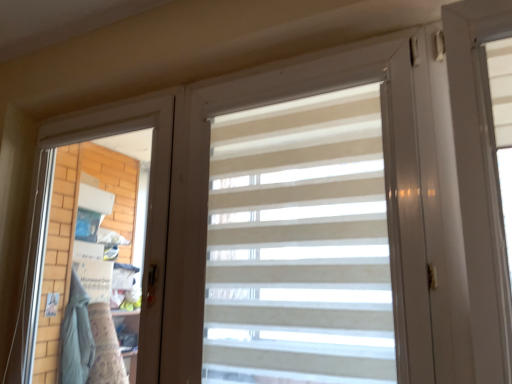
Question: Should I look upward or downward to see beige striped curtain at center?

Choices:
 (A) up
 (B) down

Answer: (B)

Question: Is beige striped curtain at center looking in the opposite direction of white matte screen door at left?

Choices:
 (A) no
 (B) yes

Answer: (A)

Question: Can you see beige striped curtain at center touching white matte screen door at left?

Choices:
 (A) no
 (B) yes

Answer: (A)

Question: From a real-world perspective, is beige striped curtain at center beneath white matte screen door at left?

Choices:
 (A) no
 (B) yes

Answer: (A)

Question: Is beige striped curtain at center positioned beyond the bounds of white matte screen door at left?

Choices:
 (A) yes
 (B) no

Answer: (A)

Question: Is beige striped curtain at center behind white matte screen door at left?

Choices:
 (A) no
 (B) yes

Answer: (A)

Question: Is beige striped curtain at center to the right of white matte screen door at left from the viewer's perspective?

Choices:
 (A) no
 (B) yes

Answer: (B)

Question: Can you confirm if white matte screen door at left is bigger than beige striped curtain at center?

Choices:
 (A) no
 (B) yes

Answer: (B)

Question: From the image's perspective, is white matte screen door at left above beige striped curtain at center?

Choices:
 (A) no
 (B) yes

Answer: (A)

Question: Is white matte screen door at left to the left of beige striped curtain at center from the viewer's perspective?

Choices:
 (A) yes
 (B) no

Answer: (A)

Question: Is white matte screen door at left looking in the opposite direction of beige striped curtain at center?

Choices:
 (A) no
 (B) yes

Answer: (A)

Question: From a real-world perspective, is white matte screen door at left on top of beige striped curtain at center?

Choices:
 (A) yes
 (B) no

Answer: (B)

Question: Does white matte screen door at left lie in front of beige striped curtain at center?

Choices:
 (A) yes
 (B) no

Answer: (B)

Question: In terms of width, does white matte screen door at left look wider or thinner when compared to beige striped curtain at center?

Choices:
 (A) thin
 (B) wide

Answer: (A)